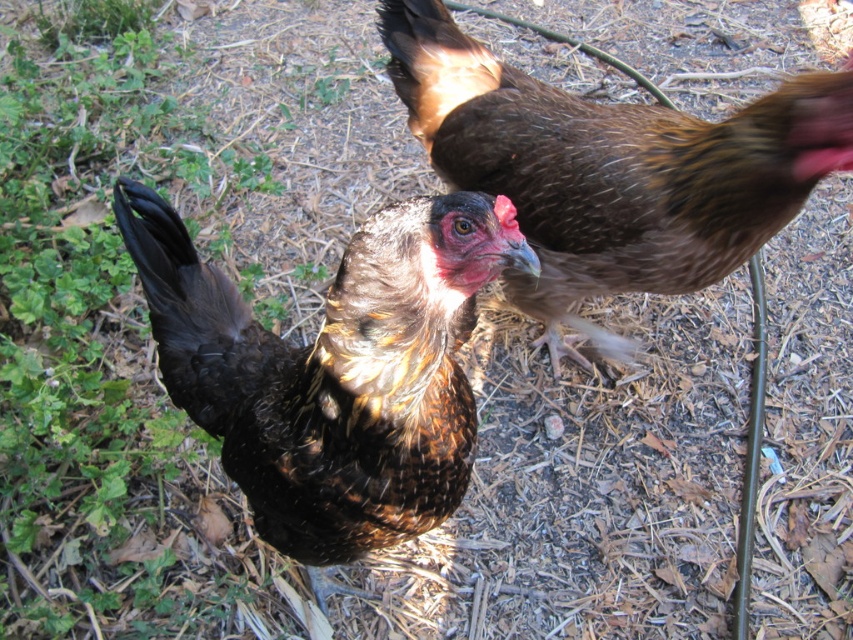
Which of these two, brown speckled feathered chicken at center or brown speckled feather at upper right, stands taller?

Standing taller between the two is brown speckled feather at upper right.

Is point (229, 401) less distant than point (392, 13)?

Yes, it is in front of point (392, 13).

Where is `brown speckled feathered chicken at center`? The height and width of the screenshot is (640, 853). brown speckled feathered chicken at center is located at coordinates (334, 369).

You are a GUI agent. You are given a task and a screenshot of the screen. Output one action in this format:
    pyautogui.click(x=<x>, y=<y>)
    Task: Click on the brown speckled feathered chicken at center
    Image resolution: width=853 pixels, height=640 pixels.
    Given the screenshot: What is the action you would take?
    pyautogui.click(x=334, y=369)